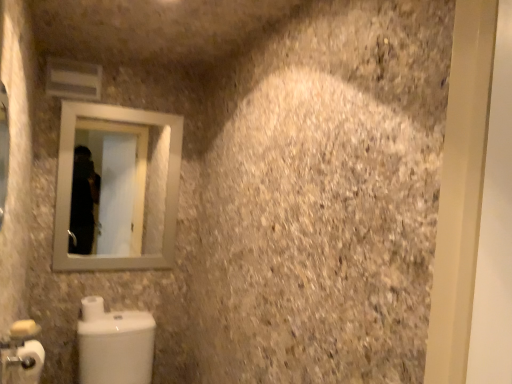
Locate an element on the screen. white matte toilet paper at lower left, the first toilet paper in the front-to-back sequence is located at coordinates (26, 363).

What is the approximate height of white matte toilet paper at lower left, the first toilet paper in the front-to-back sequence?

It is 10.62 centimeters.

What is the approximate height of white glossy toilet at lower left?

45.10 centimeters.

What do you see at coordinates (117, 348) in the screenshot? I see `white glossy toilet at lower left` at bounding box center [117, 348].

What do you see at coordinates (92, 308) in the screenshot? I see `white matte toilet paper at lower left, arranged as the second toilet paper when viewed from the front` at bounding box center [92, 308].

At what (x,y) coordinates should I click in order to perform the action: click on white matte toilet paper at lower left, the first toilet paper in the front-to-back sequence. Please return your answer as a coordinate pair (x, y). This screenshot has width=512, height=384. Looking at the image, I should click on (26, 363).

Is white matte toilet paper at lower left, the first toilet paper in the front-to-back sequence, at the right side of silver metallic mirror at upper left?

No.

Considering the sizes of objects white matte toilet paper at lower left, the first toilet paper in the front-to-back sequence, and silver metallic mirror at upper left in the image provided, who is taller, white matte toilet paper at lower left, the first toilet paper in the front-to-back sequence, or silver metallic mirror at upper left?

silver metallic mirror at upper left is taller.

In the scene shown: Measure the distance from white matte toilet paper at lower left, the first toilet paper in the front-to-back sequence, to silver metallic mirror at upper left.

white matte toilet paper at lower left, the first toilet paper in the front-to-back sequence, is 8.95 feet from silver metallic mirror at upper left.

From a real-world perspective, is white matte toilet paper at lower left, the first toilet paper in the front-to-back sequence, positioned under silver metallic mirror at upper left based on gravity?

Yes, from a real-world perspective, white matte toilet paper at lower left, the first toilet paper in the front-to-back sequence, is beneath silver metallic mirror at upper left.

Is silver metallic mirror at upper left to the right of white glossy toilet at lower left from the viewer's perspective?

No.

Based on the photo, which of these two, silver metallic mirror at upper left or white glossy toilet at lower left, is wider?

white glossy toilet at lower left is wider.

Is white glossy toilet at lower left inside silver metallic mirror at upper left?

No, silver metallic mirror at upper left does not contain white glossy toilet at lower left.

Is point (95, 181) closer to camera compared to point (104, 319)?

No, it is behind (104, 319).

Between white matte toilet paper at lower left, the first toilet paper in the front-to-back sequence, and white matte toilet paper at lower left, arranged as the second toilet paper when viewed from the front, which one has more height?

white matte toilet paper at lower left, arranged as the second toilet paper when viewed from the front.

Considering the relative positions of white matte toilet paper at lower left, which is the second toilet paper in back-to-front order, and white matte toilet paper at lower left, acting as the 1th toilet paper starting from the back, in the image provided, is white matte toilet paper at lower left, which is the second toilet paper in back-to-front order, to the left of white matte toilet paper at lower left, acting as the 1th toilet paper starting from the back, from the viewer's perspective?

No, white matte toilet paper at lower left, which is the second toilet paper in back-to-front order, is not to the left of white matte toilet paper at lower left, acting as the 1th toilet paper starting from the back.

There is a white matte toilet paper at lower left, arranged as the second toilet paper when viewed from the front. Where is `toilet paper above it (from a real-world perspective)`? toilet paper above it (from a real-world perspective) is located at coordinates (26, 363).

Is white matte toilet paper at lower left, which is the second toilet paper in back-to-front order, bigger than white matte toilet paper at lower left, acting as the 1th toilet paper starting from the back?

Incorrect, white matte toilet paper at lower left, which is the second toilet paper in back-to-front order, is not larger than white matte toilet paper at lower left, acting as the 1th toilet paper starting from the back.

Is white glossy toilet at lower left placed right next to white matte toilet paper at lower left, which is the second toilet paper in back-to-front order?

No.

Considering the sizes of objects white glossy toilet at lower left and white matte toilet paper at lower left, which is the second toilet paper in back-to-front order, in the image provided, who is wider, white glossy toilet at lower left or white matte toilet paper at lower left, which is the second toilet paper in back-to-front order,?

Wider between the two is white glossy toilet at lower left.

From the image's perspective, would you say white glossy toilet at lower left is shown under white matte toilet paper at lower left, the first toilet paper in the front-to-back sequence?

Yes.

Between white glossy toilet at lower left and white matte toilet paper at lower left, which is the second toilet paper in back-to-front order, which one has smaller size?

white matte toilet paper at lower left, which is the second toilet paper in back-to-front order.

Considering their positions, is white matte toilet paper at lower left, acting as the 1th toilet paper starting from the back, located in front of or behind silver metallic mirror at upper left?

Clearly, white matte toilet paper at lower left, acting as the 1th toilet paper starting from the back, is behind silver metallic mirror at upper left.

Based on their positions, is white matte toilet paper at lower left, acting as the 1th toilet paper starting from the back, located to the left or right of silver metallic mirror at upper left?

white matte toilet paper at lower left, acting as the 1th toilet paper starting from the back, is to the left of silver metallic mirror at upper left.

Does white matte toilet paper at lower left, arranged as the second toilet paper when viewed from the front, have a larger size compared to silver metallic mirror at upper left?

→ Incorrect, white matte toilet paper at lower left, arranged as the second toilet paper when viewed from the front, is not larger than silver metallic mirror at upper left.

From the image's perspective, is white matte toilet paper at lower left, acting as the 1th toilet paper starting from the back, located above silver metallic mirror at upper left?

No.

From a real-world perspective, which is physically below, white glossy toilet at lower left or silver metallic mirror at upper left?

From a 3D spatial view, white glossy toilet at lower left is below.

Is white glossy toilet at lower left behind silver metallic mirror at upper left?

No, white glossy toilet at lower left is closer to the viewer.

Which is correct: white glossy toilet at lower left is inside silver metallic mirror at upper left, or outside of it?

white glossy toilet at lower left cannot be found inside silver metallic mirror at upper left.

Can you confirm if silver metallic mirror at upper left is thinner than white matte toilet paper at lower left, arranged as the second toilet paper when viewed from the front?

Correct, the width of silver metallic mirror at upper left is less than that of white matte toilet paper at lower left, arranged as the second toilet paper when viewed from the front.

How different are the orientations of silver metallic mirror at upper left and white matte toilet paper at lower left, arranged as the second toilet paper when viewed from the front, in degrees?

2.1 degrees.

In the scene shown: From the image's perspective, is silver metallic mirror at upper left located beneath white matte toilet paper at lower left, arranged as the second toilet paper when viewed from the front?

No, from the image's perspective, silver metallic mirror at upper left is not below white matte toilet paper at lower left, arranged as the second toilet paper when viewed from the front.

Is silver metallic mirror at upper left turned away from white matte toilet paper at lower left, acting as the 1th toilet paper starting from the back?

silver metallic mirror at upper left does not have its back to white matte toilet paper at lower left, acting as the 1th toilet paper starting from the back.

Identify the location of mirror lying above the white matte toilet paper at lower left, the first toilet paper in the front-to-back sequence (from the image's perspective). (121, 185).

Where is `toilet bowl lying below the silver metallic mirror at upper left (from the image's perspective)`? The width and height of the screenshot is (512, 384). toilet bowl lying below the silver metallic mirror at upper left (from the image's perspective) is located at coordinates (117, 348).

From the image, which object appears to be farther from white glossy toilet at lower left, white matte toilet paper at lower left, acting as the 1th toilet paper starting from the back, or silver metallic mirror at upper left?

silver metallic mirror at upper left is positioned further to the anchor white glossy toilet at lower left.

Which object lies nearer to the anchor point white matte toilet paper at lower left, arranged as the second toilet paper when viewed from the front, silver metallic mirror at upper left or white matte toilet paper at lower left, the first toilet paper in the front-to-back sequence?

white matte toilet paper at lower left, the first toilet paper in the front-to-back sequence, is closer to white matte toilet paper at lower left, arranged as the second toilet paper when viewed from the front.

From the image, which object appears to be nearer to white glossy toilet at lower left, white matte toilet paper at lower left, the first toilet paper in the front-to-back sequence, or white matte toilet paper at lower left, acting as the 1th toilet paper starting from the back?

white matte toilet paper at lower left, acting as the 1th toilet paper starting from the back, is closer to white glossy toilet at lower left.

From the image, which object appears to be farther from white matte toilet paper at lower left, arranged as the second toilet paper when viewed from the front, white glossy toilet at lower left or white matte toilet paper at lower left, which is the second toilet paper in back-to-front order?

white matte toilet paper at lower left, which is the second toilet paper in back-to-front order, is positioned further to the anchor white matte toilet paper at lower left, arranged as the second toilet paper when viewed from the front.

In the scene shown: When comparing their distances from white glossy toilet at lower left, does white matte toilet paper at lower left, arranged as the second toilet paper when viewed from the front, or white matte toilet paper at lower left, which is the second toilet paper in back-to-front order, seem closer?

white matte toilet paper at lower left, arranged as the second toilet paper when viewed from the front, lies closer to white glossy toilet at lower left than the other object.

From the image, which object appears to be farther from silver metallic mirror at upper left, white matte toilet paper at lower left, arranged as the second toilet paper when viewed from the front, or white glossy toilet at lower left?

white matte toilet paper at lower left, arranged as the second toilet paper when viewed from the front, is further to silver metallic mirror at upper left.

From the image, which object appears to be farther from white matte toilet paper at lower left, the first toilet paper in the front-to-back sequence, white glossy toilet at lower left or silver metallic mirror at upper left?

Among the two, silver metallic mirror at upper left is located further to white matte toilet paper at lower left, the first toilet paper in the front-to-back sequence.

Based on their spatial positions, is white glossy toilet at lower left or white matte toilet paper at lower left, acting as the 1th toilet paper starting from the back, further from silver metallic mirror at upper left?

white matte toilet paper at lower left, acting as the 1th toilet paper starting from the back, lies further to silver metallic mirror at upper left than the other object.

The image size is (512, 384). I want to click on mirror between white matte toilet paper at lower left, the first toilet paper in the front-to-back sequence, and white matte toilet paper at lower left, arranged as the second toilet paper when viewed from the front, from front to back, so click(x=121, y=185).

Where is `toilet bowl between white matte toilet paper at lower left, the first toilet paper in the front-to-back sequence, and white matte toilet paper at lower left, acting as the 1th toilet paper starting from the back, along the z-axis`? toilet bowl between white matte toilet paper at lower left, the first toilet paper in the front-to-back sequence, and white matte toilet paper at lower left, acting as the 1th toilet paper starting from the back, along the z-axis is located at coordinates (117, 348).